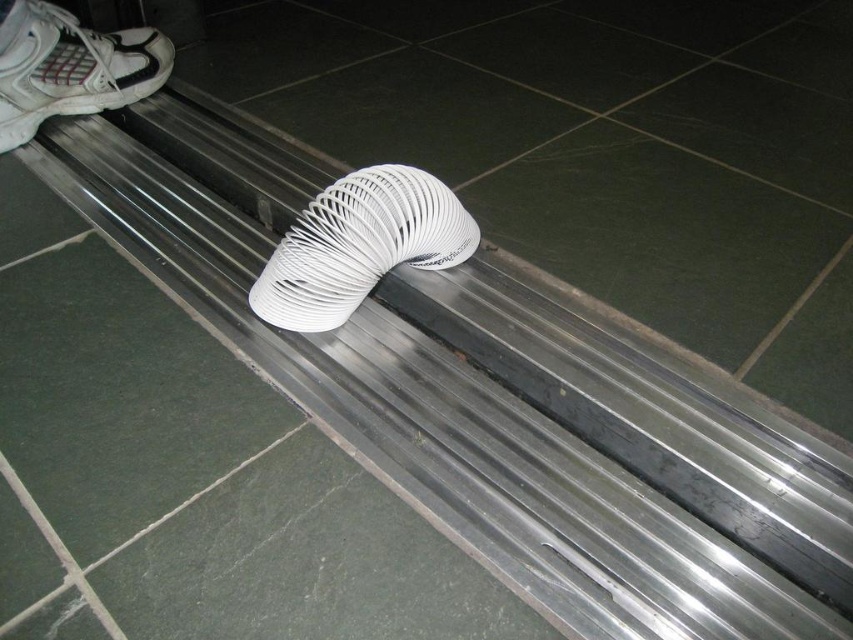
You are standing in front of the bench and want to reach a point that is 1.11 meters away from you. Is the point at coordinates point [370,262] on the bench within your reach?

The point [370,262] is 1.11 meters away from you, so if your reach extends at least 1.11 meters, you can reach it. However, typical human reach is about 1 meter, so it might be slightly out of reach.

You are a maintenance worker inspecting the bench. You need to reach both the white flexible hose at center and the white matte shoe at upper left. Which object is easier to grab without moving your position?

The white flexible hose at center is closer to the viewer than the white matte shoe at upper left, so it is easier to grab without moving your position.

You are a janitor in a public space. You see a white flexible hose at center and a white matte shoe at upper left. Which object is closer to the floor?

The white flexible hose at center is closer to the floor because it is located below the white matte shoe at upper left.